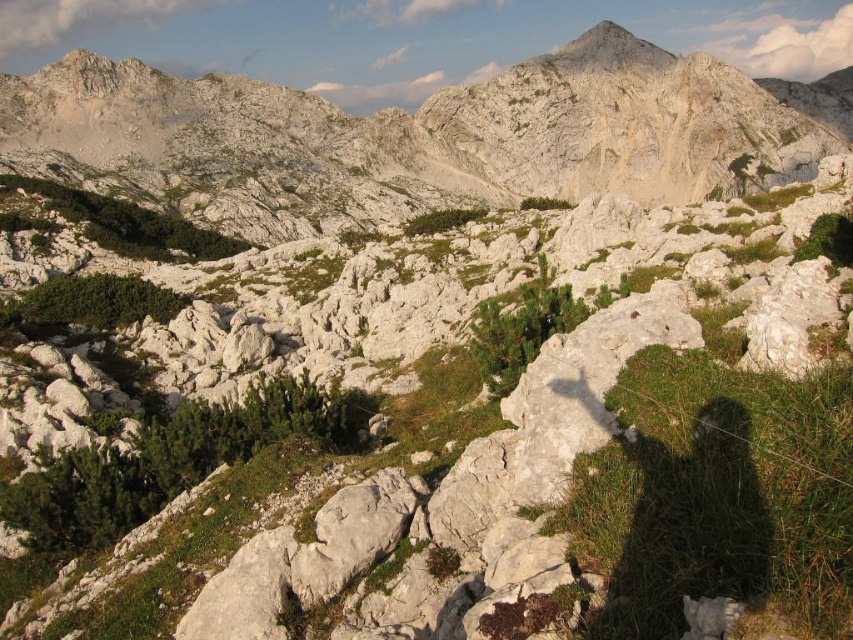
Question: Which point is closer to the camera?

Choices:
 (A) smooth gray rock peak at upper center
 (B) white rocky mountain at center

Answer: (B)

Question: Can you confirm if white rocky mountain at center is bigger than smooth gray rock peak at upper center?

Choices:
 (A) yes
 (B) no

Answer: (A)

Question: Observing the image, what is the correct spatial positioning of white rocky mountain at center in reference to smooth gray rock peak at upper center?

Choices:
 (A) above
 (B) below

Answer: (B)

Question: Among these points, which one is farthest from the camera?

Choices:
 (A) (471, 116)
 (B) (582, 42)

Answer: (B)

Question: In this image, where is white rocky mountain at center located relative to smooth gray rock peak at upper center?

Choices:
 (A) right
 (B) left

Answer: (B)